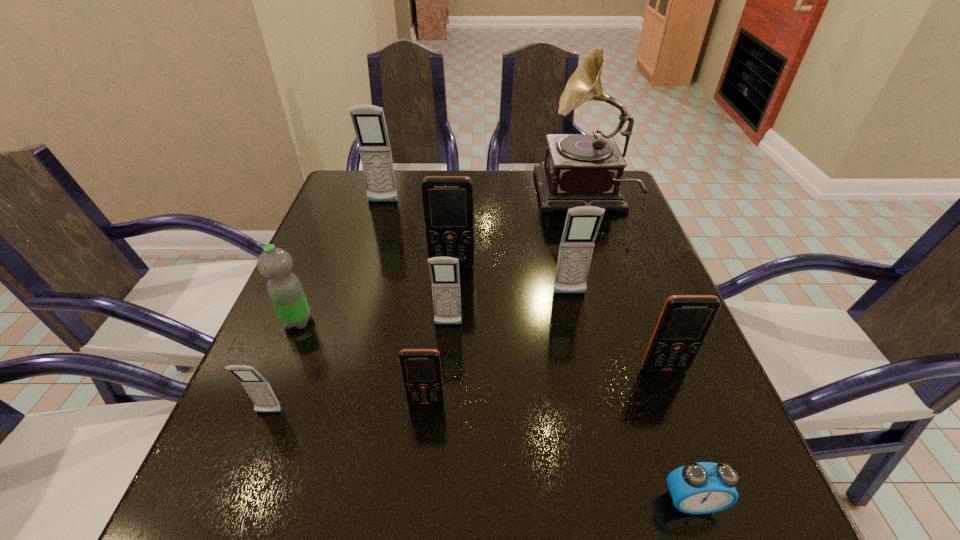
You are a GUI agent. You are given a task and a screenshot of the screen. Output one action in this format:
    pyautogui.click(x=<x>, y=<y>)
    Task: Click on the free region located on the horn of the golden record player
    This screenshot has height=540, width=960.
    Given the screenshot: What is the action you would take?
    pyautogui.click(x=513, y=195)

Where is `free point located 0.230m on the horn of the golden record player`? The width and height of the screenshot is (960, 540). free point located 0.230m on the horn of the golden record player is located at coordinates (455, 195).

Find the location of a particular element. The height and width of the screenshot is (540, 960). blank space located on the front-facing side of the farthest cellular telephone is located at coordinates coord(353,302).

Locate an element on the screen. This screenshot has width=960, height=540. vacant region located on the front-facing side of the rightmost gray cellular telephone is located at coordinates (579, 336).

Where is `free space located on the screen of the farthest orange cellular telephone`? The image size is (960, 540). free space located on the screen of the farthest orange cellular telephone is located at coordinates point(444,383).

The width and height of the screenshot is (960, 540). In order to click on free space located on the front of the green water bottle in this screenshot , I will do 267,395.

Locate an element on the screen. The image size is (960, 540). blank area located on the front-facing side of the fourth nearest cellular telephone is located at coordinates (438, 467).

Locate an element on the screen. The height and width of the screenshot is (540, 960). free point located on the screen of the second farthest orange cellular telephone is located at coordinates (705, 477).

You are a GUI agent. You are given a task and a screenshot of the screen. Output one action in this format:
    pyautogui.click(x=<x>, y=<y>)
    Task: Click on the vacant space located 0.180m on the screen of the smallest orange cellular telephone
    This screenshot has width=960, height=540.
    Given the screenshot: What is the action you would take?
    pyautogui.click(x=414, y=525)

This screenshot has width=960, height=540. I want to click on vacant region located 0.080m on the front-facing side of the smallest gray cellular telephone, so click(248, 466).